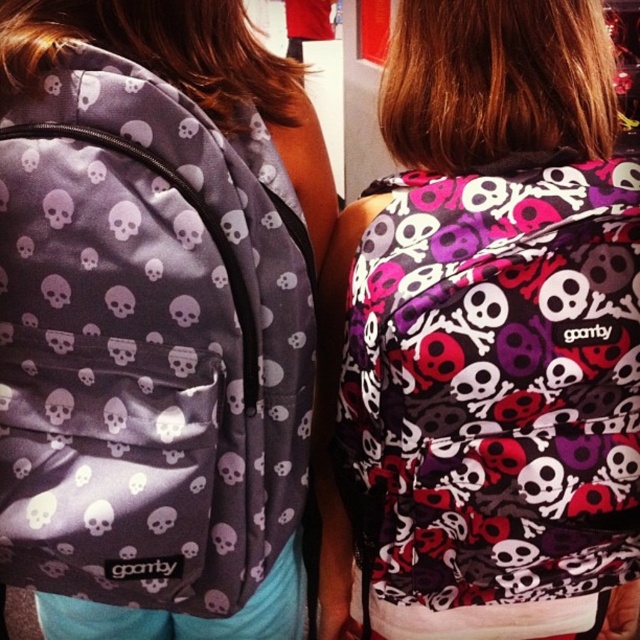
You are standing in a store and see a matte purple backpack at center. Can you tell me the exact coordinates where it is located?

The matte purple backpack at center is located at point (484, 340).